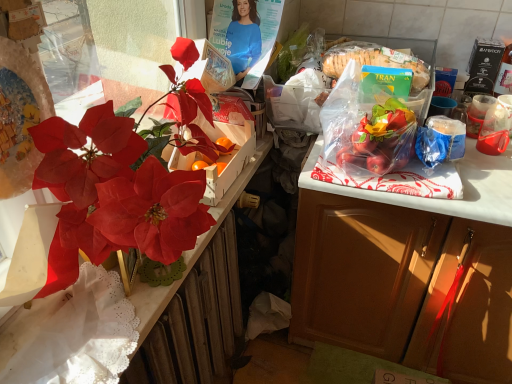
The image size is (512, 384). What are the coordinates of `vacant area that is in front of transparent plastic coffee cup at upper right, which appears as the first coffee cup when viewed from the left` in the screenshot? It's located at (484, 167).